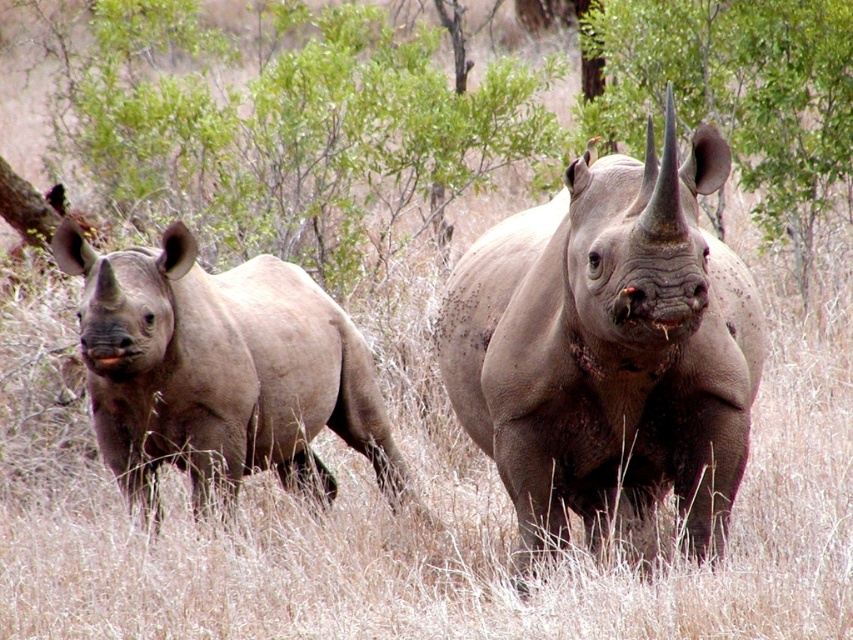
Question: In this image, where is gray textured rhino at center located relative to matte gray rhino at left?

Choices:
 (A) above
 (B) below

Answer: (A)

Question: From the image, what is the correct spatial relationship of gray textured rhino at center in relation to matte gray rhino at left?

Choices:
 (A) left
 (B) right

Answer: (B)

Question: Which of the following is the farthest from the observer?

Choices:
 (A) (743, 413)
 (B) (132, 381)

Answer: (B)

Question: Which object is closer to the camera taking this photo?

Choices:
 (A) gray textured rhino at center
 (B) matte gray rhino at left

Answer: (A)

Question: Is gray textured rhino at center above matte gray rhino at left?

Choices:
 (A) no
 (B) yes

Answer: (B)